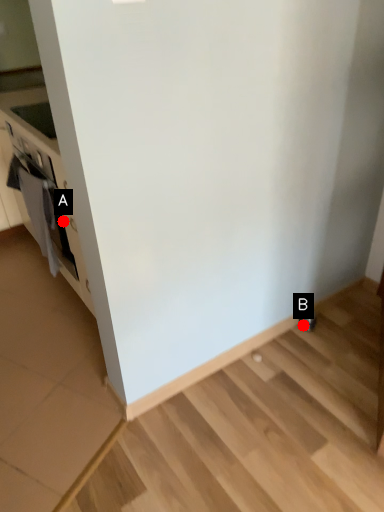
Question: Two points are circled on the image, labeled by A and B beside each circle. Which point is closer to the camera?

Choices:
 (A) A is closer
 (B) B is closer

Answer: (A)